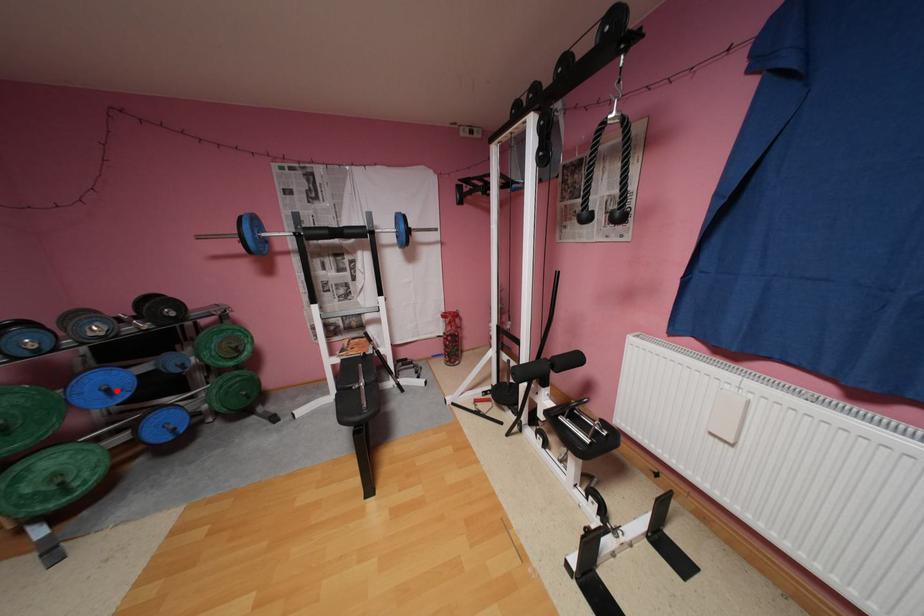
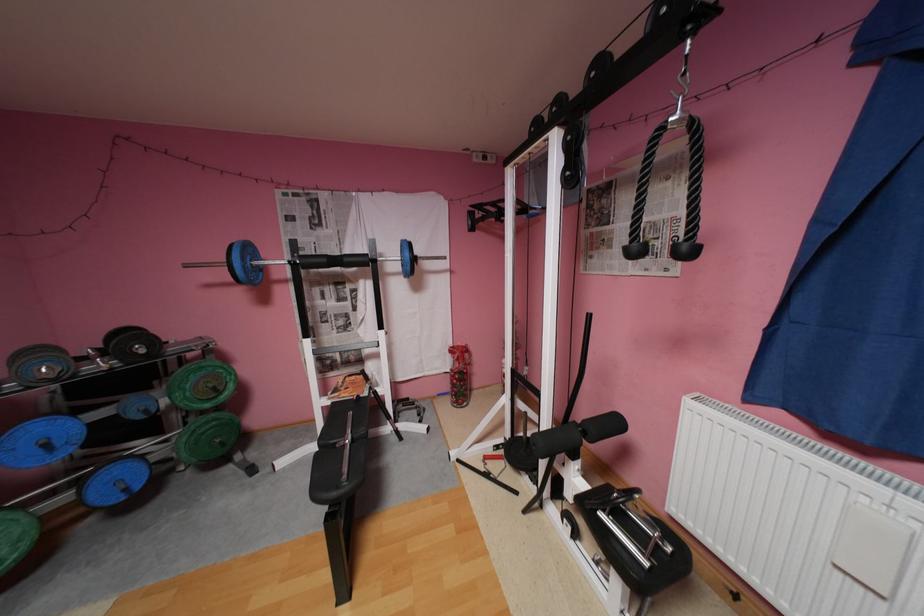
Locate, in the second image, the point that corresponds to the highlighted location in the first image.

(55, 445)